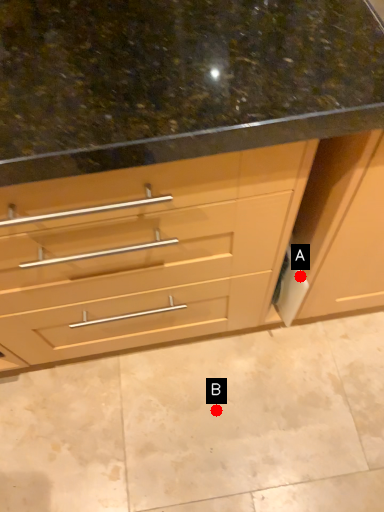
Question: Two points are circled on the image, labeled by A and B beside each circle. Which point is farther from the camera taking this photo?

Choices:
 (A) A is further
 (B) B is further

Answer: (B)